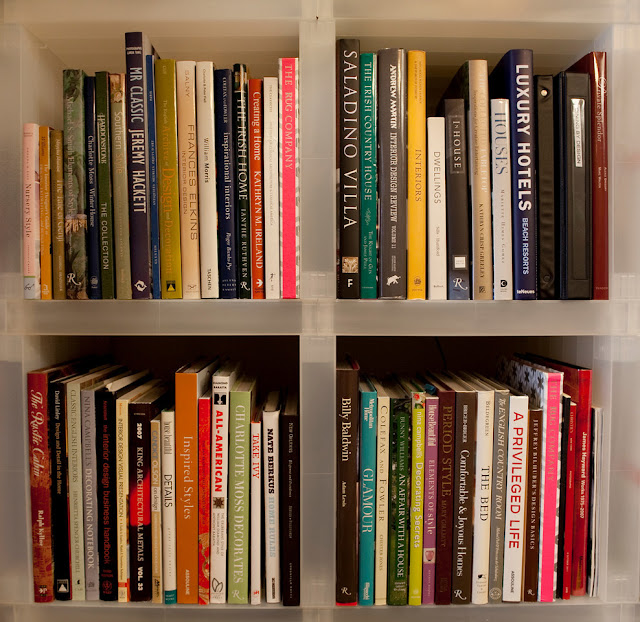
Identify the location of blue book. This screenshot has width=640, height=622. (150, 168).